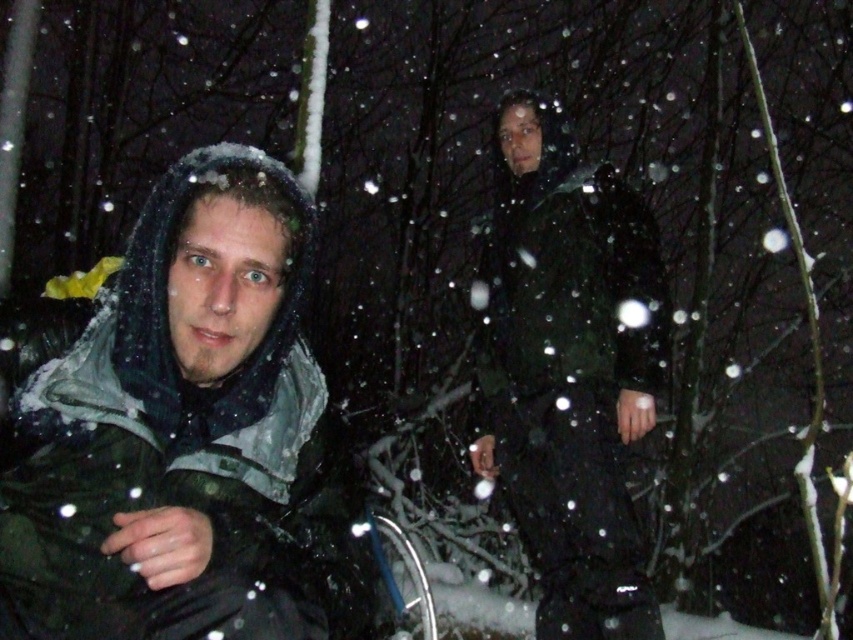
Question: Which of the following is the farthest from the observer?

Choices:
 (A) matte black jacket at left
 (B) dark green jacket at center

Answer: (B)

Question: Can you confirm if matte black jacket at left is bigger than dark green jacket at center?

Choices:
 (A) no
 (B) yes

Answer: (A)

Question: Can you confirm if matte black jacket at left is smaller than dark green jacket at center?

Choices:
 (A) yes
 (B) no

Answer: (A)

Question: Can you confirm if matte black jacket at left is positioned to the right of dark green jacket at center?

Choices:
 (A) no
 (B) yes

Answer: (A)